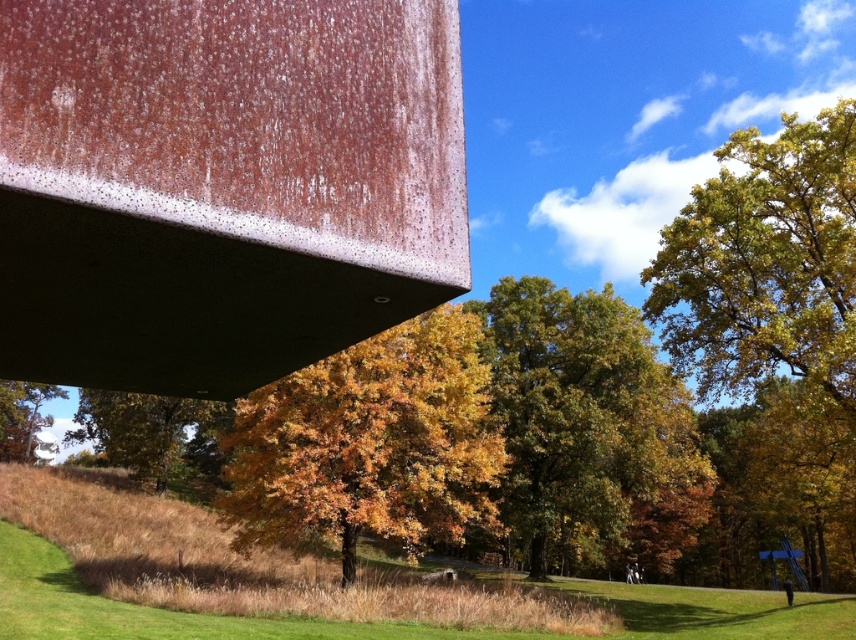
You are standing in the autumn scene and notice two groups of golden yellow leaves. One is the golden yellow leaves at right and the other is the golden yellow leaves at center. Which group is located more to the east if the sun is setting in the west?

The golden yellow leaves at right is positioned on the right side of golden yellow leaves at center. Since the sun is setting in the west, the right side would be facing east, so the golden yellow leaves at right is more to the east.